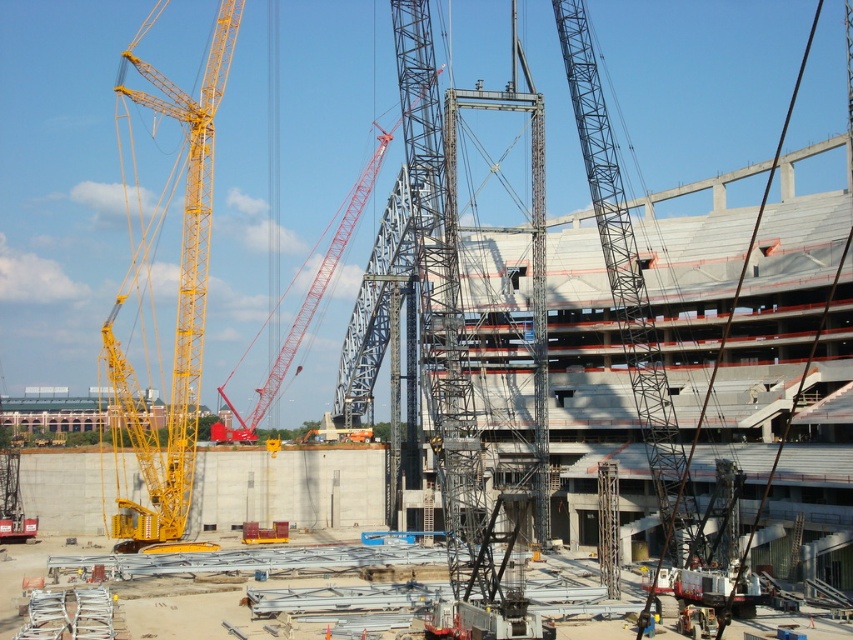
You are an inspector standing at the edge of the construction site. You need to determine if the red metallic crane at center can be safely moved past the dark blue uniform at center without damaging either. Based on their widths, can this be done?

The red metallic crane at center is wider than the dark blue uniform at center, so moving the crane past the uniform may require careful maneuvering to avoid collision, as the crane is wider and could potentially hit the uniform if not aligned properly.

You are an engineer inspecting a construction site. You notice a yellow metallic crane at left and a dark blue uniform at center. Which object is larger in size?

The yellow metallic crane at left is bigger than the dark blue uniform at center.

You are an engineer observing the construction site. You notice the yellow metallic crane at left and the metallic gray crane at center. Which crane is positioned higher in the air compared to the other?

The yellow metallic crane at left is positioned higher in the air than the metallic gray crane at center because it is above it.